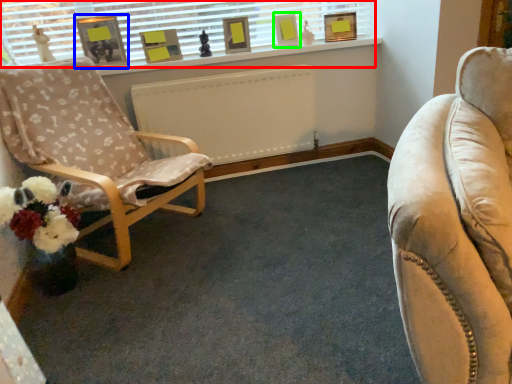
Question: Based on their relative distances, which object is nearer to window (highlighted by a red box)? Choose from picture frame (highlighted by a blue box) and picture frame (highlighted by a green box).

Choices:
 (A) picture frame
 (B) picture frame

Answer: (A)